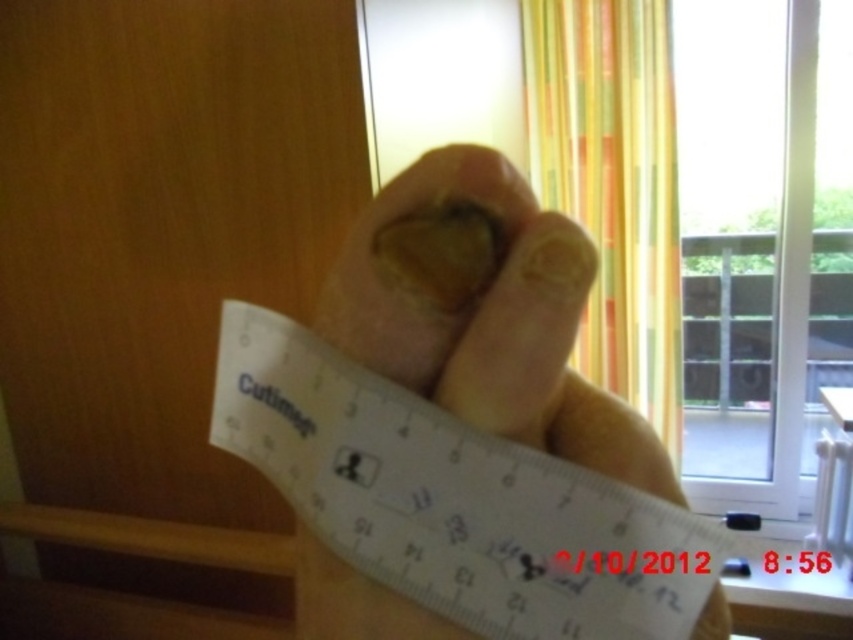
Does transparent plastic ruler at center have a lesser height compared to yellow striped curtain at upper center?

Correct, transparent plastic ruler at center is not as tall as yellow striped curtain at upper center.

Is transparent plastic ruler at center thinner than yellow striped curtain at upper center?

Yes, transparent plastic ruler at center is thinner than yellow striped curtain at upper center.

What do you see at coordinates (453, 499) in the screenshot? I see `transparent plastic ruler at center` at bounding box center [453, 499].

Image resolution: width=853 pixels, height=640 pixels. Identify the location of transparent plastic ruler at center. (453, 499).